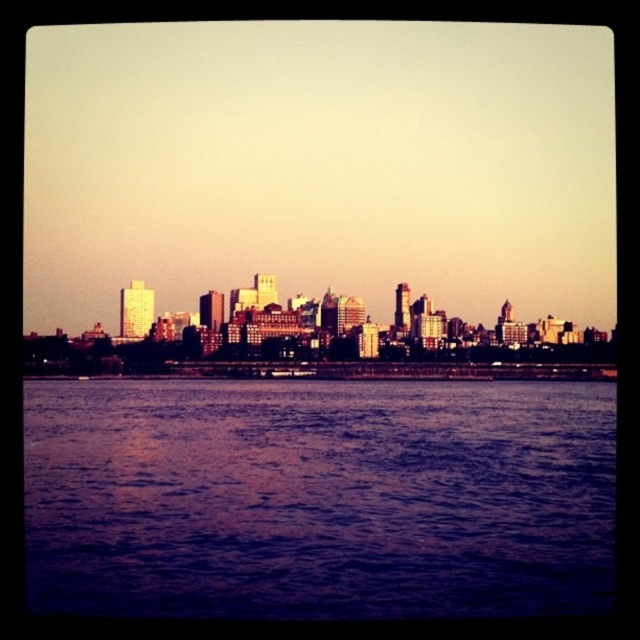
Can you confirm if purple water at center is smaller than matte urban skyline at center?

Incorrect, purple water at center is not smaller in size than matte urban skyline at center.

Who is taller, purple water at center or matte urban skyline at center?

purple water at center is taller.

The image size is (640, 640). What do you see at coordinates (317, 497) in the screenshot?
I see `purple water at center` at bounding box center [317, 497].

The width and height of the screenshot is (640, 640). Identify the location of purple water at center. (317, 497).

Does point (476, 333) come in front of point (292, 371)?

No, (476, 333) is behind (292, 371).

Is matte urban skyline at center above metallic silver boat at center?

Indeed, matte urban skyline at center is positioned over metallic silver boat at center.

I want to click on matte urban skyline at center, so click(x=320, y=342).

Is point (502, 573) positioned behind point (275, 372)?

Yes.

Is purple water at center closer to camera compared to metallic silver boat at center?

No.

At what (x,y) coordinates should I click in order to perform the action: click on purple water at center. Please return your answer as a coordinate pair (x, y). Looking at the image, I should click on (317, 497).